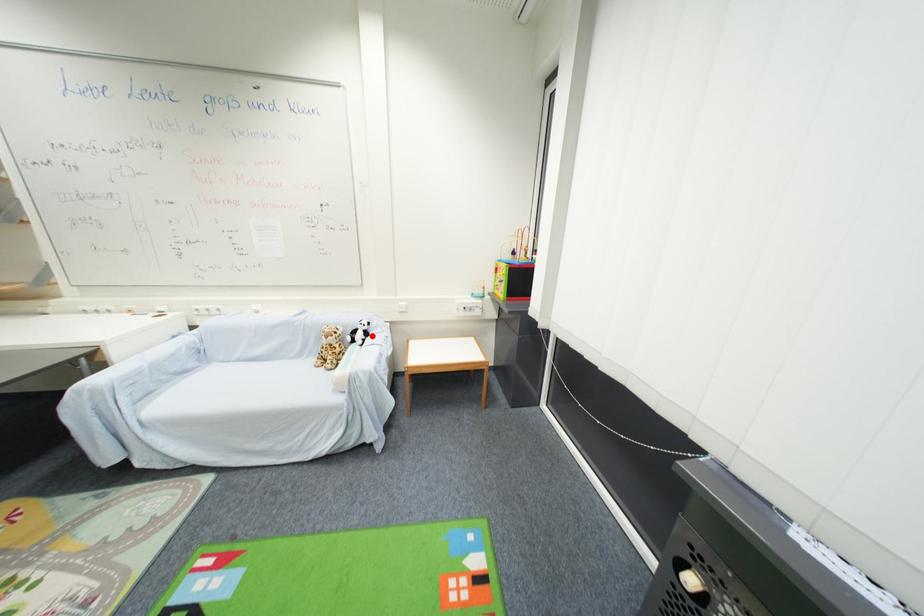
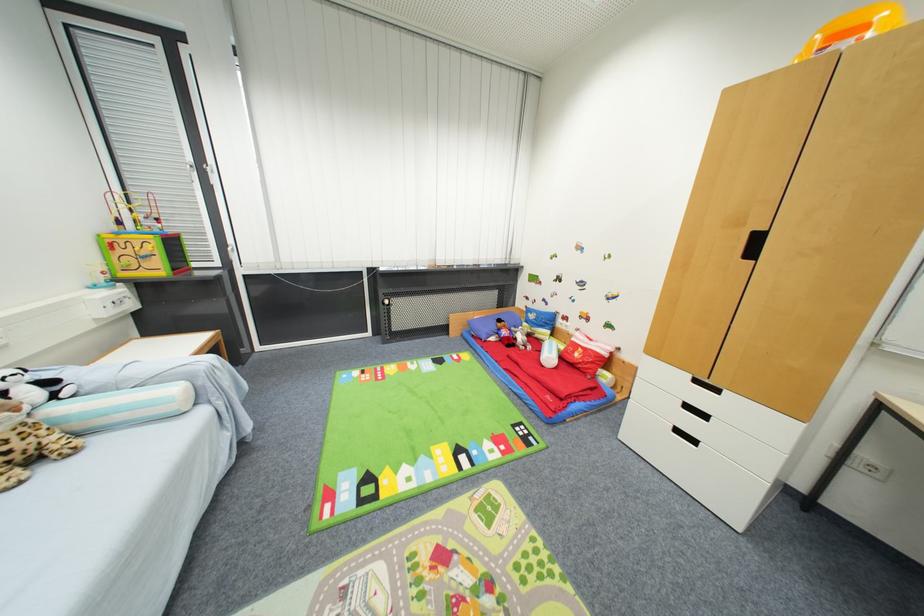
Question: I am providing you with two images of the same scene from different viewpoints. Given a red point in image1, look at the same physical point in image2. Is it:

Choices:
 (A) Closer to the viewpoint
 (B) Farther from the viewpoint

Answer: (B)